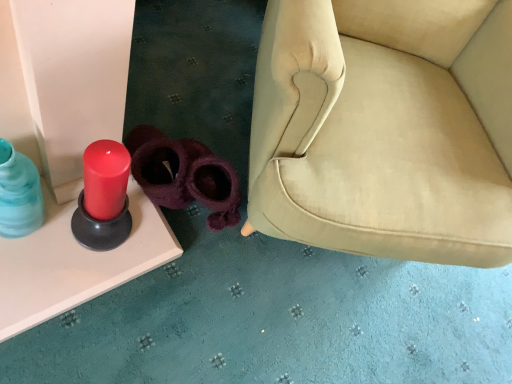
Question: Is purple fuzzy slippers at center, the 2th footwear when ordered from right to left, bigger or smaller than translucent blue glass bottle at left?

Choices:
 (A) small
 (B) big

Answer: (B)

Question: From their relative heights in the image, would you say purple fuzzy slippers at center, positioned as the first footwear in left-to-right order, is taller or shorter than translucent blue glass bottle at left?

Choices:
 (A) tall
 (B) short

Answer: (B)

Question: Estimate the real-world distances between objects in this image. Which object is farther from the translucent blue glass bottle at left?

Choices:
 (A) purple fuzzy slippers at lower center, the first footwear positioned from the right
 (B) matte red candle at left
 (C) purple fuzzy slippers at center, positioned as the first footwear in left-to-right order

Answer: (A)

Question: Which of these objects is positioned closest to the purple fuzzy slippers at center, positioned as the first footwear in left-to-right order?

Choices:
 (A) translucent blue glass bottle at left
 (B) matte red candle at left
 (C) purple fuzzy slippers at lower center, the first footwear positioned from the right

Answer: (C)